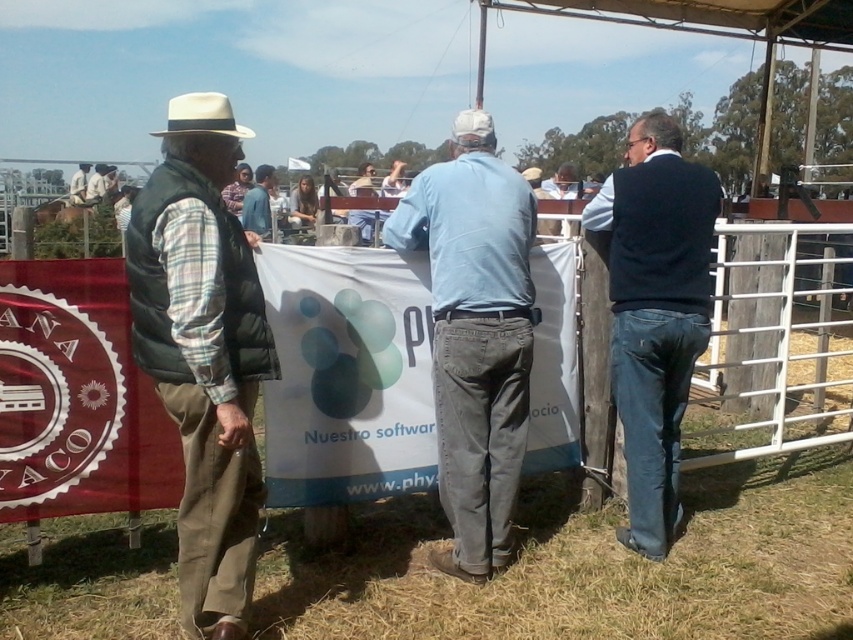
Is point (505, 269) positioned before point (97, 198)?

Yes, it is in front of point (97, 198).

Who is more distant from viewer, (459, 189) or (103, 164)?

Positioned behind is point (103, 164).

Identify the location of light blue denim jeans at center. (474, 336).

From the picture: Does green puffy vest at left have a greater height compared to blue denim shirt at center?

Indeed, green puffy vest at left has a greater height compared to blue denim shirt at center.

Describe the element at coordinates (202, 353) in the screenshot. Image resolution: width=853 pixels, height=640 pixels. I see `green puffy vest at left` at that location.

Consider the image. Who is more forward, (183, 364) or (265, 211)?

Positioned in front is point (183, 364).

At what (x,y) coordinates should I click in order to perform the action: click on green puffy vest at left. Please return your answer as a coordinate pair (x, y). The width and height of the screenshot is (853, 640). Looking at the image, I should click on (202, 353).

Is point (683, 365) farther from viewer compared to point (97, 184)?

No, (683, 365) is in front of (97, 184).

Does dark blue sweater at right have a greater width compared to light brown leather jacket at left?

No.

Which is behind, point (648, 243) or point (86, 198)?

The point (86, 198) is more distant.

In order to click on dark blue sweater at right in this screenshot , I will do `click(654, 312)`.